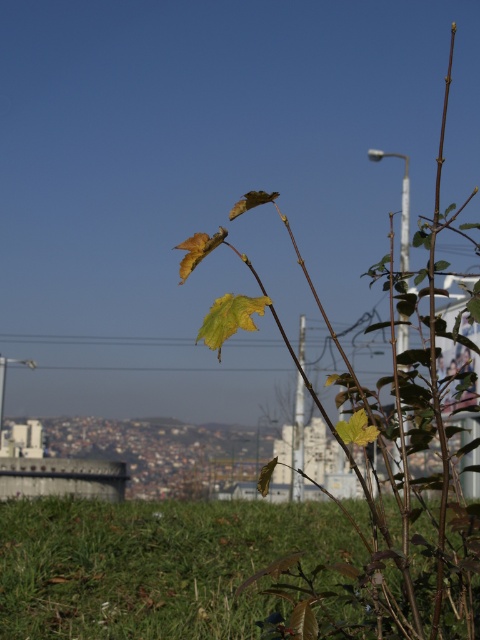
In the scene shown: You are a photographer who wants to focus on the plant with slender stems in the foreground. You notice two points in the image at coordinates point (260, 609) and point (317, 605). Which point is closer to the camera and should be in focus if you want to maintain the plant as the main subject?

Point (260, 609) is further to the camera than point (317, 605). Therefore, to keep the plant in focus, you should focus on point (260, 609) as it is closer to the camera compared to the other point.

You are a photographer who wants to capture a closeup of the green matte leaf at center without the green grassy at lower left being in focus. Based on the scene, can you adjust your camera settings to achieve this?

The green grassy at lower left is further to the viewer than green matte leaf at center, so to keep the green matte leaf at center in focus and blur the green grassy at lower left, you need to decrease the depth of field by using a wider aperture setting.

You are a gardener with a 2.5 meter long hose. You need to water both the green grassy at lower left and the green matte leaf at center. Can your hose reach both areas from your current position?

The distance between the green grassy at lower left and the green matte leaf at center is 1.99 meters. Since your hose is 2.5 meters long, it can easily reach both areas as the distance is shorter than the hose length.